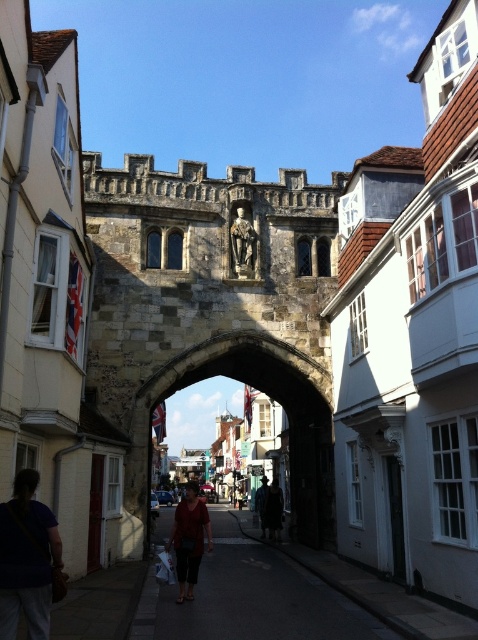
Question: Is dark blue shirt at lower left further to the viewer compared to dark blue jeans at center?

Choices:
 (A) yes
 (B) no

Answer: (B)

Question: Estimate the real-world distances between objects in this image. Which object is farther from the matte red dress at center?

Choices:
 (A) dark blue shirt at lower left
 (B) dark gray asphalt at center
 (C) dark blue jeans at center
 (D) dark brown leather jacket at center

Answer: (C)

Question: Is dark blue shirt at lower left thinner than dark brown leather jacket at center?

Choices:
 (A) yes
 (B) no

Answer: (B)

Question: Which object is the closest to the dark blue shirt at lower left?

Choices:
 (A) dark gray asphalt at center
 (B) dark brown leather jacket at center
 (C) dark blue jeans at center
 (D) matte red dress at center

Answer: (A)

Question: Does dark blue shirt at lower left lie behind matte red dress at center?

Choices:
 (A) no
 (B) yes

Answer: (A)

Question: Which object appears farthest from the camera in this image?

Choices:
 (A) matte red dress at center
 (B) dark blue jeans at center

Answer: (B)